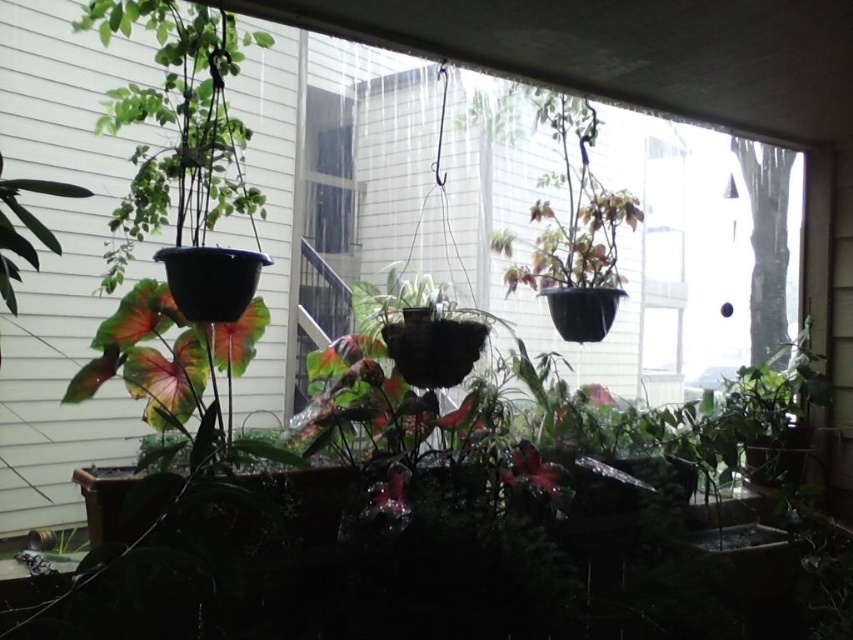
Between green matte leaf at left and green matte leaf at lower left, which one is positioned lower?

Positioned lower is green matte leaf at lower left.

Who is shorter, green matte leaf at left or green matte leaf at lower left?

With less height is green matte leaf at lower left.

Between point (51, 244) and point (50, 548), which one is positioned in front?

Point (51, 244)

The width and height of the screenshot is (853, 640). In order to click on green matte leaf at left in this screenshot , I will do `click(36, 193)`.

Is matte black pot at left in front of green matte hanging plant at upper center?

Yes, matte black pot at left is in front of green matte hanging plant at upper center.

Between matte black pot at left and green matte hanging plant at upper center, which one appears on the right side from the viewer's perspective?

green matte hanging plant at upper center

Identify the location of matte black pot at left. This screenshot has width=853, height=640. (177, 122).

Find the location of a particular element. Image resolution: width=853 pixels, height=640 pixels. matte black pot at left is located at coordinates coord(177,122).

What do you see at coordinates (566, 193) in the screenshot? This screenshot has height=640, width=853. I see `green matte hanging plant at upper center` at bounding box center [566, 193].

Is green matte hanging plant at upper center below green matte leaf at left?

Incorrect, green matte hanging plant at upper center is not positioned below green matte leaf at left.

I want to click on green matte hanging plant at upper center, so click(566, 193).